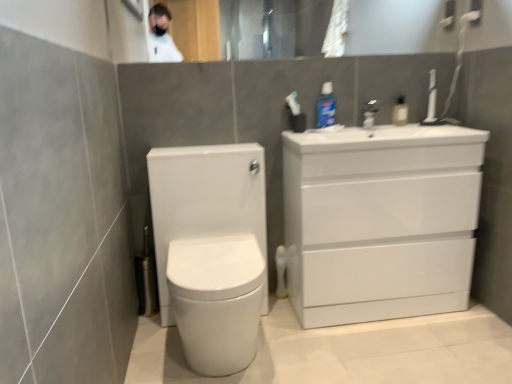
Question: Is glossy glass mirror at upper center thinner than satin nickel faucet at upper center?

Choices:
 (A) yes
 (B) no

Answer: (A)

Question: Does glossy glass mirror at upper center come in front of satin nickel faucet at upper center?

Choices:
 (A) yes
 (B) no

Answer: (A)

Question: From the image's perspective, is glossy glass mirror at upper center located beneath satin nickel faucet at upper center?

Choices:
 (A) no
 (B) yes

Answer: (A)

Question: Considering the relative positions of glossy glass mirror at upper center and satin nickel faucet at upper center in the image provided, is glossy glass mirror at upper center behind satin nickel faucet at upper center?

Choices:
 (A) yes
 (B) no

Answer: (B)

Question: Is glossy glass mirror at upper center at the right side of satin nickel faucet at upper center?

Choices:
 (A) yes
 (B) no

Answer: (B)

Question: Would you say glossy glass mirror at upper center is outside satin nickel faucet at upper center?

Choices:
 (A) no
 (B) yes

Answer: (B)

Question: Is clear plastic bottle at upper center, which is the 1th toiletry in right-to-left order, looking in the opposite direction of blue glossy mouthwash at upper center, the 1th toiletry when ordered from left to right?

Choices:
 (A) no
 (B) yes

Answer: (A)

Question: Can you confirm if clear plastic bottle at upper center, which is the 1th toiletry in right-to-left order, is positioned to the right of blue glossy mouthwash at upper center, the 1th toiletry when ordered from left to right?

Choices:
 (A) no
 (B) yes

Answer: (B)

Question: From a real-world perspective, is clear plastic bottle at upper center, which is the 1th toiletry in right-to-left order, over blue glossy mouthwash at upper center, which is the second toiletry from right to left?

Choices:
 (A) no
 (B) yes

Answer: (A)

Question: Is clear plastic bottle at upper center, which is the 1th toiletry in right-to-left order, next to blue glossy mouthwash at upper center, the 1th toiletry when ordered from left to right?

Choices:
 (A) no
 (B) yes

Answer: (A)

Question: Does clear plastic bottle at upper center, the 2th toiletry in the left-to-right sequence, have a larger size compared to blue glossy mouthwash at upper center, which is the second toiletry from right to left?

Choices:
 (A) no
 (B) yes

Answer: (A)

Question: Considering the relative sizes of clear plastic bottle at upper center, which is the 1th toiletry in right-to-left order, and blue glossy mouthwash at upper center, the 1th toiletry when ordered from left to right, in the image provided, is clear plastic bottle at upper center, which is the 1th toiletry in right-to-left order, thinner than blue glossy mouthwash at upper center, the 1th toiletry when ordered from left to right,?

Choices:
 (A) yes
 (B) no

Answer: (A)

Question: From the image's perspective, does glossy glass mirror at upper center appear lower than clear plastic bottle at upper center, which is the 1th toiletry in right-to-left order?

Choices:
 (A) no
 (B) yes

Answer: (A)